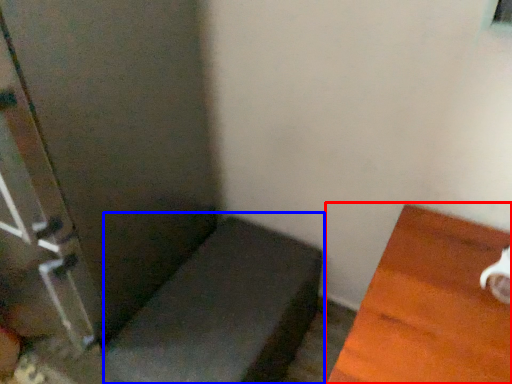
Question: Which point is closer to the camera, furniture (highlighted by a red box) or furniture (highlighted by a blue box)?

Choices:
 (A) furniture
 (B) furniture

Answer: (A)